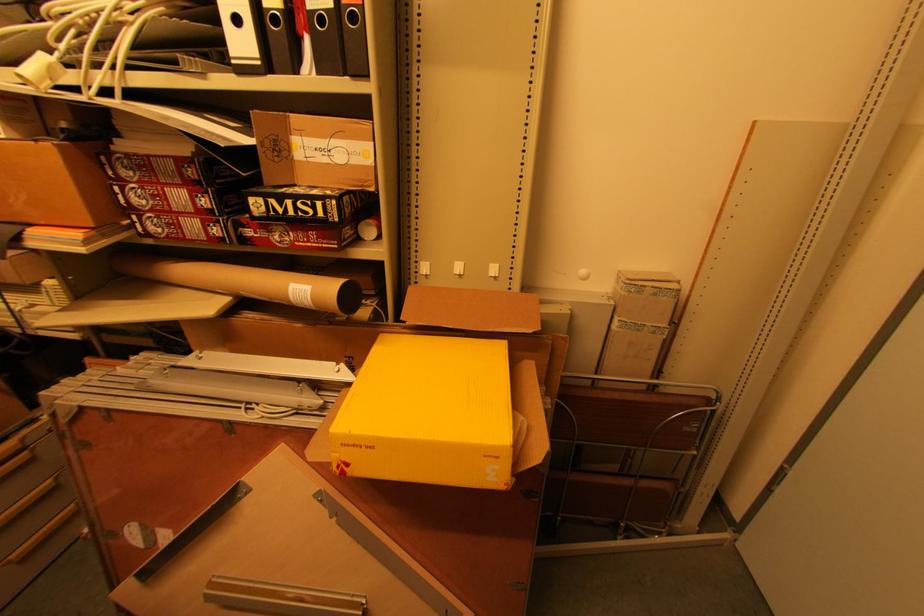
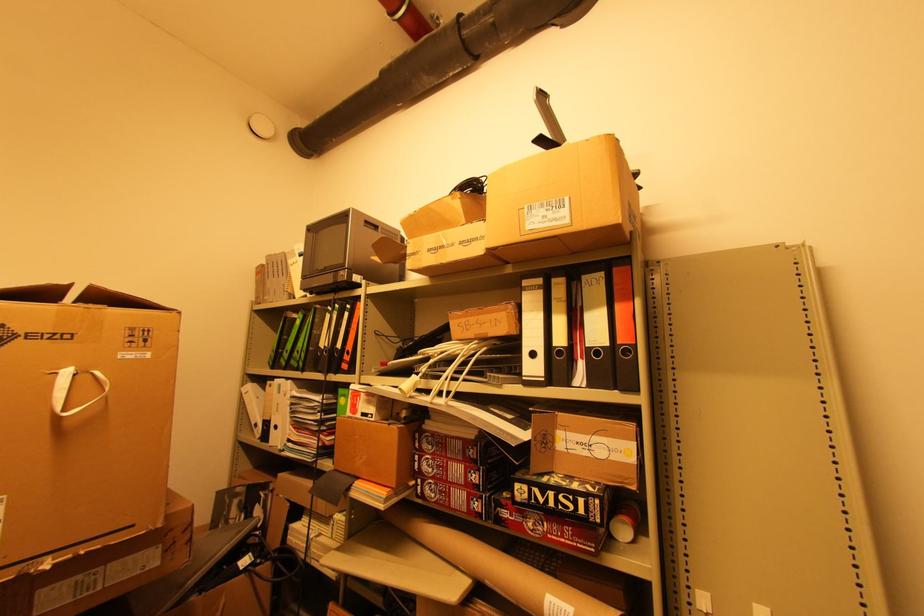
In the second image, find the point that corresponds to (x=359, y=236) in the first image.

(611, 535)